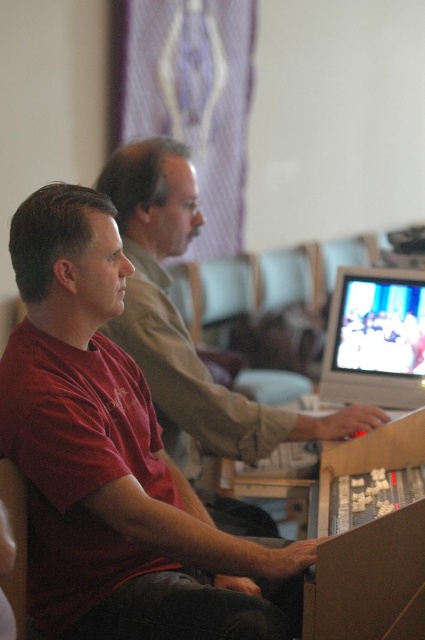
You are standing in front of the control panel and need to reach the matte red shirt at center. Which direction should you move relative to your current position?

The matte red shirt at center is located at point coordinates, so you should move towards the center of the control panel to reach it.